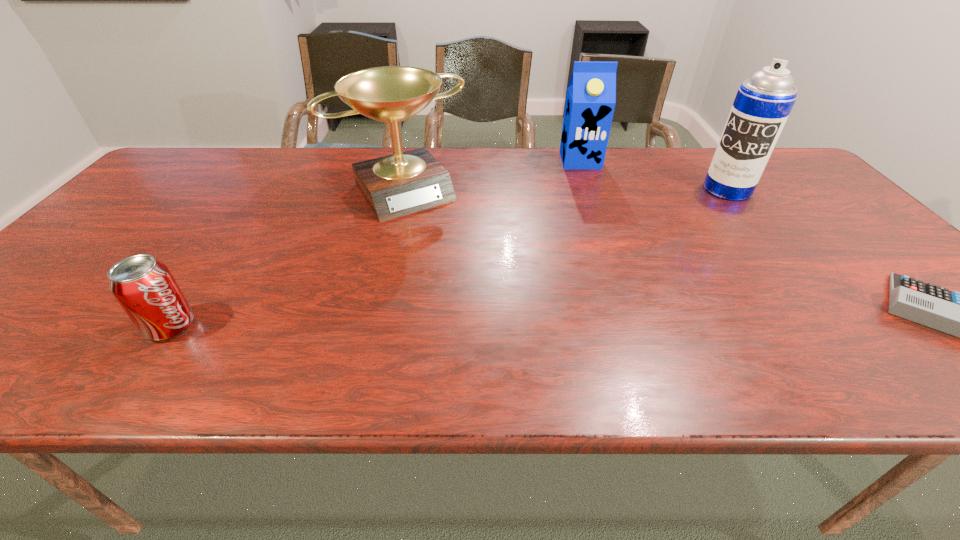
Locate an element on the screen. soda can is located at coordinates (144, 287).

Where is `the fourth tallest object`? the fourth tallest object is located at coordinates (144, 287).

Identify the location of the tallest object. (763, 103).

Locate an element on the screen. aerosol can is located at coordinates (763, 103).

Where is `award`? award is located at coordinates (396, 185).

The width and height of the screenshot is (960, 540). I want to click on carton, so click(591, 94).

Find the location of a particular element. The width and height of the screenshot is (960, 540). free region located on the left of the soda can is located at coordinates (104, 326).

You are a GUI agent. You are given a task and a screenshot of the screen. Output one action in this format:
    pyautogui.click(x=<x>, y=<y>)
    Task: Click on the vacant space located 0.150m on the label side of the aerosol can
    This screenshot has height=540, width=960.
    Given the screenshot: What is the action you would take?
    [x=702, y=222]

You are a GUI agent. You are given a task and a screenshot of the screen. Output one action in this format:
    pyautogui.click(x=<x>, y=<y>)
    Task: Click on the free space located on the label side of the aerosol can
    
    Given the screenshot: What is the action you would take?
    pyautogui.click(x=707, y=216)

This screenshot has width=960, height=540. Find the location of `free location located 0.100m on the label side of the aerosol can`. free location located 0.100m on the label side of the aerosol can is located at coordinates (708, 214).